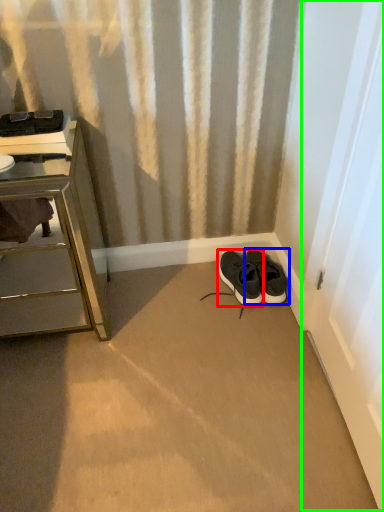
Question: Estimate the real-world distances between objects in this image. Which object is closer to shoe (highlighted by a red box), footwear (highlighted by a blue box) or screen door (highlighted by a green box)?

Choices:
 (A) footwear
 (B) screen door

Answer: (A)